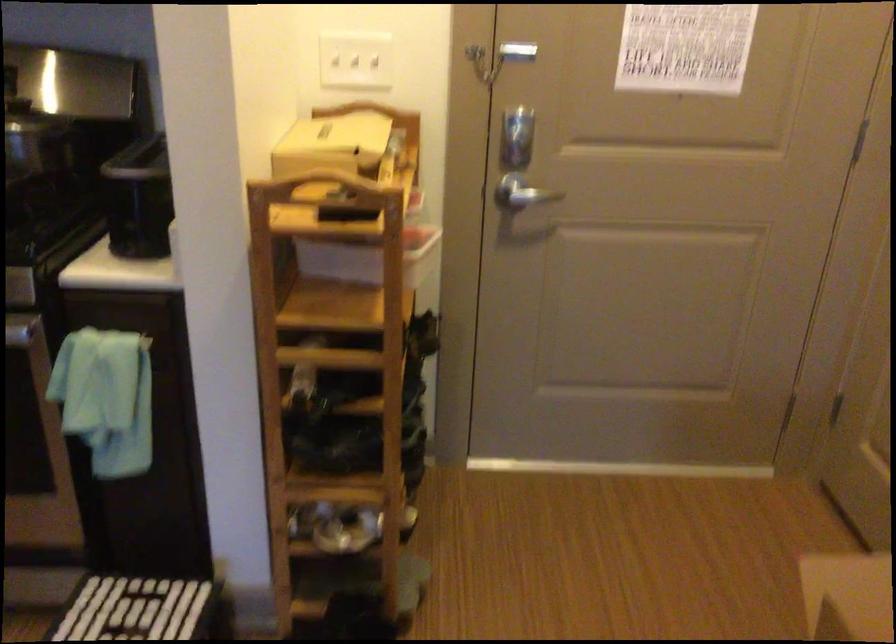
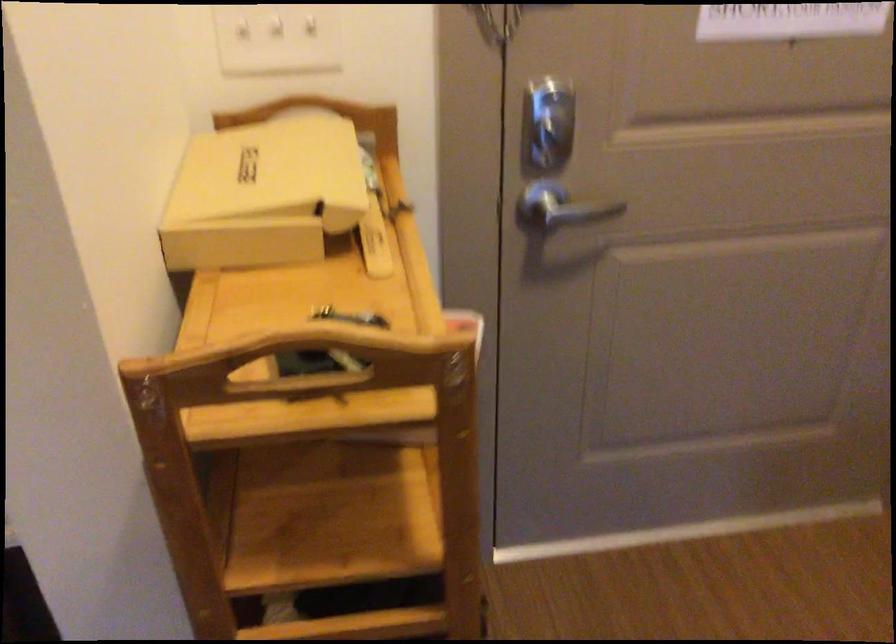
The point at [389,174] is marked in the first image. Where is the corresponding point in the second image?

(375, 242)